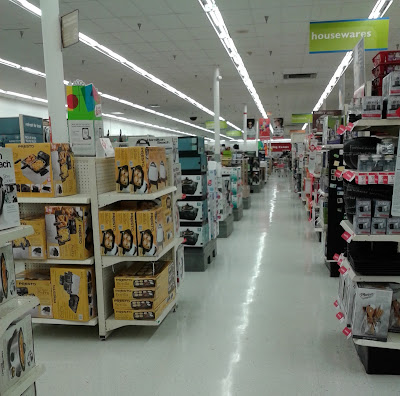
This screenshot has width=400, height=396. What are the coordinates of `green housewares sign` in the screenshot? It's located at (340, 36).